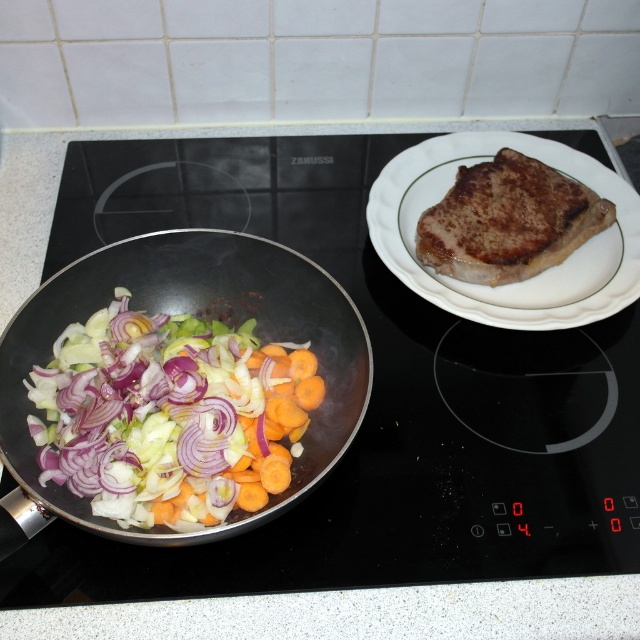
You are standing in front of the kitchen stovetop and want to place a spice jar between the two points marked as point (291, 499) and point (545, 280). Which point should you place the spice jar closer to in order to have it appear larger in your view?

You should place the spice jar closer to point (291, 499) because it is closer to the camera than point (545, 280), so objects near it will appear larger in your view.

You are a chef preparing a meal and need to place a garnish on the white ceramic plate at upper right. Given that the black matte wok at left is below it, where should you position yourself to reach the plate without obstructing the wok?

Since the black matte wok at left is below the white ceramic plate at upper right, you should position yourself in a higher position or move closer to the upper area to reach the plate without obstructing the wok.

You are a chef standing in front of the stove. You need to grab the black matte wok at left to stir the vegetables. Considering your arm can reach 24 inches, can you reach it without moving your position?

The black matte wok at left is 19.14 inches away from camera, so yes, the chef can reach it with their arm span of 24 inches.